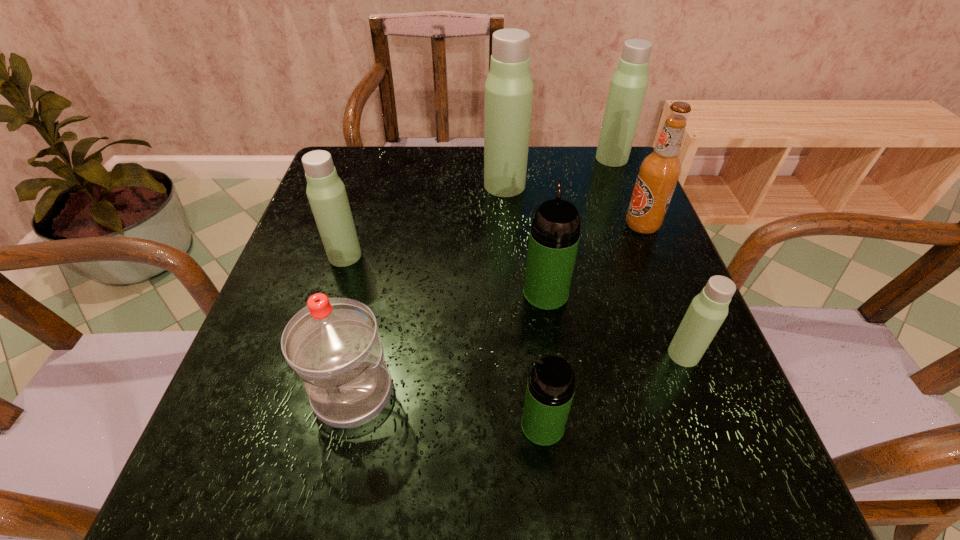
Locate an element on the screen. the tallest thermos bottle is located at coordinates tap(509, 87).

In order to click on the tallest object in this screenshot , I will do `click(509, 87)`.

This screenshot has width=960, height=540. Find the location of `the third smallest light thermos bottle`. the third smallest light thermos bottle is located at coordinates (628, 86).

The height and width of the screenshot is (540, 960). I want to click on the farthest thermos bottle, so click(628, 86).

Find the location of a particular element. This screenshot has height=540, width=960. beer bottle is located at coordinates (659, 172).

Identify the location of the fourth nearest object. This screenshot has height=540, width=960. (554, 237).

This screenshot has width=960, height=540. Find the location of `the farther green thermos bottle`. the farther green thermos bottle is located at coordinates (554, 237).

Where is `the fifth nearest object`? The image size is (960, 540). the fifth nearest object is located at coordinates (326, 193).

This screenshot has width=960, height=540. I want to click on the leftmost thermos bottle, so click(326, 193).

At what (x,y) coordinates should I click in order to perform the action: click on white water bottle. Please return your answer as a coordinate pair (x, y). The width and height of the screenshot is (960, 540). Looking at the image, I should click on pyautogui.click(x=332, y=344).